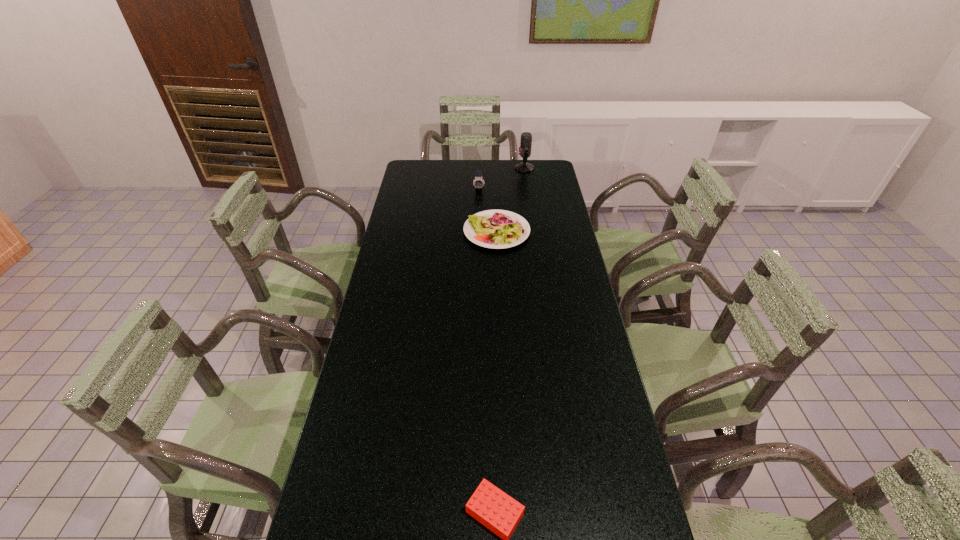
Where is `free space between the salad plate and the second farthest object`? The image size is (960, 540). free space between the salad plate and the second farthest object is located at coordinates (488, 210).

This screenshot has height=540, width=960. I want to click on free area in between the watch and the farthest object, so click(502, 178).

You are a GUI agent. You are given a task and a screenshot of the screen. Output one action in this format:
    pyautogui.click(x=<x>, y=<y>)
    Task: Click on the free space between the tallest object and the watch
    
    Given the screenshot: What is the action you would take?
    pyautogui.click(x=502, y=178)

Identify the location of unoccupied area between the salad plate and the microphone. The width and height of the screenshot is (960, 540). (511, 200).

The height and width of the screenshot is (540, 960). Find the location of `object that is the second closest to the watch`. object that is the second closest to the watch is located at coordinates (526, 138).

The image size is (960, 540). I want to click on object that ranks as the second closest to the watch, so click(526, 138).

Where is `vacant space that satisfies the following two spatial constraints: 1. on the face of the watch; 2. on the left side of the second shortest object`? The image size is (960, 540). vacant space that satisfies the following two spatial constraints: 1. on the face of the watch; 2. on the left side of the second shortest object is located at coordinates coord(479,231).

Image resolution: width=960 pixels, height=540 pixels. What are the coordinates of `vacant space that satisfies the following two spatial constraints: 1. on the side of the tallest object with the red ring; 2. on the front side of the third farthest object` in the screenshot? It's located at (534, 231).

You are a GUI agent. You are given a task and a screenshot of the screen. Output one action in this format:
    pyautogui.click(x=<x>, y=<y>)
    Task: Click on the vacant area in the image that satisfies the following two spatial constraints: 1. on the face of the third farthest object; 2. on the left side of the watch
    
    Given the screenshot: What is the action you would take?
    pyautogui.click(x=479, y=231)